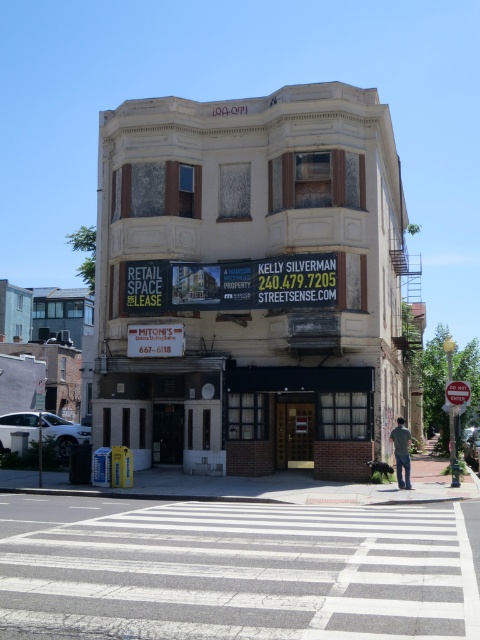
You are standing at the corner of the street looking at the building. There are two points marked on the building facade. The first point is at coordinates point (403, 428) and the second point is at point (452, 401). Which point is closer to you?

Point (403, 428) is in front of point (452, 401), so it is closer to you.

You are a delivery person trying to deliver a package to the white brick building at center. You are currently standing 20 meters away from it. Can you safely deliver the package without moving closer than 20 meters?

The distance between you and the white brick building at center is 22.50 meters, which is greater than 20 meters. Therefore, you can safely deliver the package without moving closer than 20 meters.